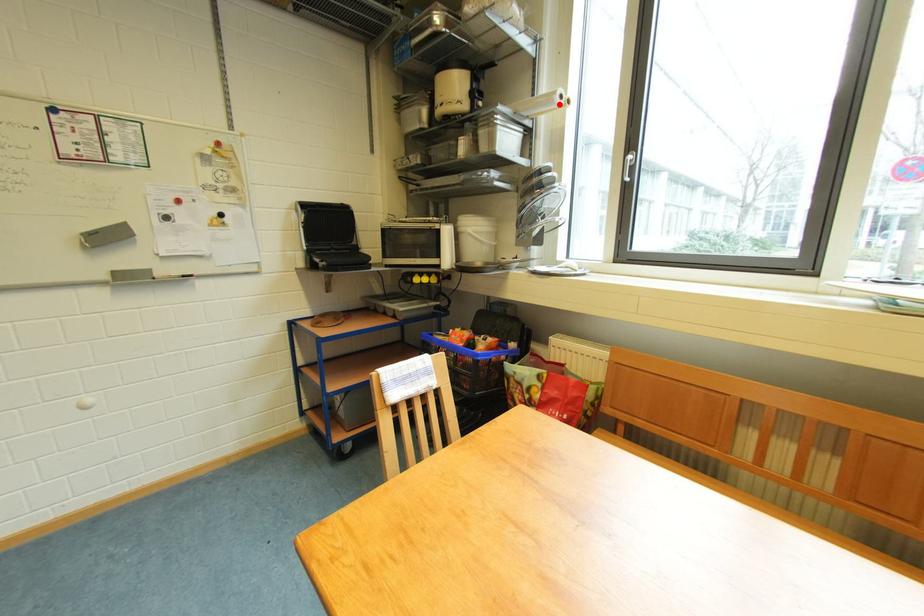
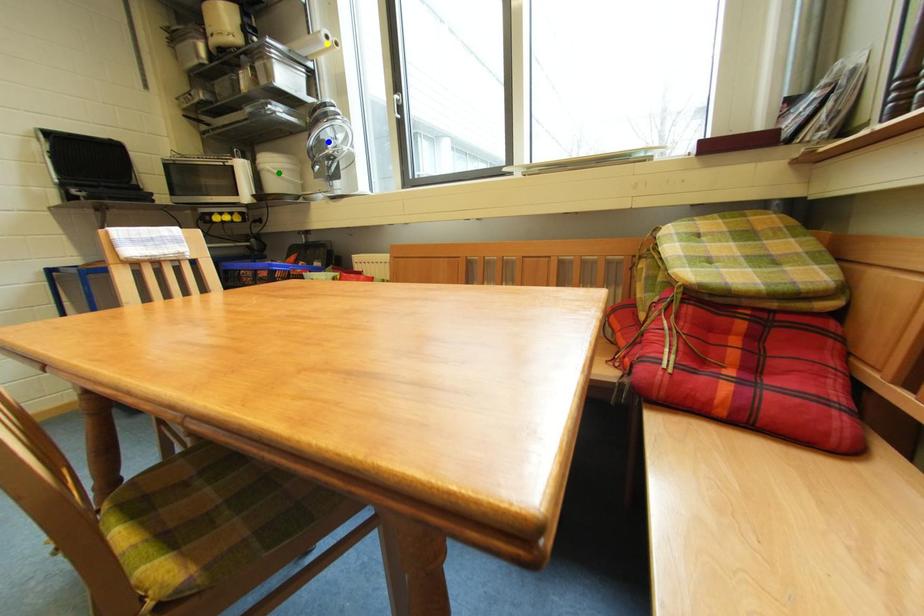
Question: I am providing you with two images of the same scene from different viewpoints. A red point is marked on the first image. You are given multiple points on the second image. Which point in image 2 is actually the same real-world point as the red point in image 1?

Choices:
 (A) blue point
 (B) yellow point
 (C) green point

Answer: (B)